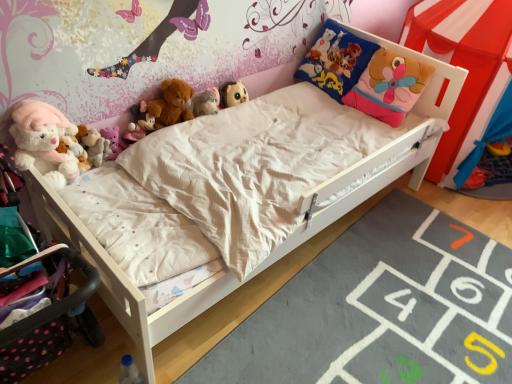
What do you see at coordinates (139, 123) in the screenshot? Image resolution: width=512 pixels, height=384 pixels. I see `matte pink plush at upper left, which ranks as the fourth toy in top-to-bottom order` at bounding box center [139, 123].

Measure the distance between red fabric canopy bed at upper right and camera.

The depth of red fabric canopy bed at upper right is 1.83 meters.

Locate an element on the screen. The height and width of the screenshot is (384, 512). fluffy plush toys at left, which ranks as the 6th toy in top-to-bottom order is located at coordinates [x=96, y=147].

Where is `matte pink plush at upper left, which ranks as the fourth toy in top-to-bottom order`? matte pink plush at upper left, which ranks as the fourth toy in top-to-bottom order is located at coordinates (139, 123).

In the scene shown: Which object is further away from the camera, gray soft rug at lower right or red fabric canopy bed at upper right?

red fabric canopy bed at upper right is more distant.

Is gray soft rug at lower right located outside red fabric canopy bed at upper right?

Yes, gray soft rug at lower right is not within red fabric canopy bed at upper right.

Is gray soft rug at lower right positioned with its back to red fabric canopy bed at upper right?

That's not correct — gray soft rug at lower right is not looking away from red fabric canopy bed at upper right.

Looking at this image, between gray soft rug at lower right and red fabric canopy bed at upper right, which one has less height?

With less height is gray soft rug at lower right.

Considering the sizes of objects fluffy white teddy bear at center, which ranks as the 1th toy in top-to-bottom order, and brown plush bear at upper center, arranged as the third toy when viewed from the top, in the image provided, who is wider, fluffy white teddy bear at center, which ranks as the 1th toy in top-to-bottom order, or brown plush bear at upper center, arranged as the third toy when viewed from the top,?

brown plush bear at upper center, arranged as the third toy when viewed from the top.

Which object is more forward, fluffy white teddy bear at center, positioned as the 8th toy in bottom-to-top order, or brown plush bear at upper center, arranged as the third toy when viewed from the top?

Positioned in front is brown plush bear at upper center, arranged as the third toy when viewed from the top.

From the image's perspective, would you say fluffy white teddy bear at center, positioned as the 8th toy in bottom-to-top order, is shown under brown plush bear at upper center, arranged as the third toy when viewed from the top?

Actually, fluffy white teddy bear at center, positioned as the 8th toy in bottom-to-top order, appears above brown plush bear at upper center, arranged as the third toy when viewed from the top, in the image.

From a real-world perspective, which object rests below the other?

fluffy plush toy at upper center, the second toy when ordered from top to bottom.

Does point (139, 139) lie behind point (212, 97)?

No.

Is matte pink plush at upper left, which ranks as the fourth toy in top-to-bottom order, placed right next to fluffy plush toy at upper center, the second toy when ordered from top to bottom?

matte pink plush at upper left, which ranks as the fourth toy in top-to-bottom order, and fluffy plush toy at upper center, the second toy when ordered from top to bottom, are clearly separated.

Does matte pink plush at upper left, which ranks as the fourth toy in top-to-bottom order, appear on the left side of fluffy plush toy at upper center, which is the 7th toy from bottom to top?

Correct, you'll find matte pink plush at upper left, which ranks as the fourth toy in top-to-bottom order, to the left of fluffy plush toy at upper center, which is the 7th toy from bottom to top.

From a real-world perspective, is fluffy plush toy at upper center, the second toy when ordered from top to bottom, physically located above or below matte pink plush at upper left, which is counted as the fifth toy, starting from the bottom?

fluffy plush toy at upper center, the second toy when ordered from top to bottom, is below matte pink plush at upper left, which is counted as the fifth toy, starting from the bottom.

Is matte pink plush at upper left, which is counted as the fifth toy, starting from the bottom, surrounded by fluffy plush toy at upper center, the second toy when ordered from top to bottom?

No.

Is fluffy plush toy at upper center, which is the 7th toy from bottom to top, bigger or smaller than matte pink plush at upper left, which is counted as the fifth toy, starting from the bottom?

In the image, fluffy plush toy at upper center, which is the 7th toy from bottom to top, appears to be smaller than matte pink plush at upper left, which is counted as the fifth toy, starting from the bottom.

From the image's perspective, which one is positioned lower, fluffy plush toy at upper center, which is the 7th toy from bottom to top, or matte pink plush at upper left, which ranks as the fourth toy in top-to-bottom order?

matte pink plush at upper left, which ranks as the fourth toy in top-to-bottom order, from the image's perspective.

Which is in front, fluffy plush toys at left, which ranks as the 6th toy in top-to-bottom order, or blue plastic bottle at lower left, the 8th toy from the top?

blue plastic bottle at lower left, the 8th toy from the top.

Considering the relative sizes of fluffy plush toys at left, which ranks as the 6th toy in top-to-bottom order, and blue plastic bottle at lower left, the first toy ordered from the bottom, in the image provided, is fluffy plush toys at left, which ranks as the 6th toy in top-to-bottom order, wider than blue plastic bottle at lower left, the first toy ordered from the bottom,?

Yes, fluffy plush toys at left, which ranks as the 6th toy in top-to-bottom order, is wider than blue plastic bottle at lower left, the first toy ordered from the bottom.

From the image's perspective, which toy is the 2nd one above the blue plastic bottle at lower left, the first toy ordered from the bottom? Please provide its 2D coordinates.

[(96, 147)]

Consider the image. Which is more to the left, fluffy plush toys at left, the third toy positioned from the bottom, or blue plastic bottle at lower left, the 8th toy from the top?

fluffy plush toys at left, the third toy positioned from the bottom.

From a real-world perspective, which object stands above the other?

fluffy plush toy at upper center, the second toy when ordered from top to bottom, is physically above.

Between blue plastic bottle at lower left, the first toy ordered from the bottom, and fluffy plush toy at upper center, the second toy when ordered from top to bottom, which one is positioned behind?

fluffy plush toy at upper center, the second toy when ordered from top to bottom, is further away from the camera.

Locate an element on the screen. Image resolution: width=512 pixels, height=384 pixels. the 4th toy positioned above the blue plastic bottle at lower left, the 8th toy from the top (from a real-world perspective) is located at coordinates [x=205, y=103].

Looking at this image, in terms of width, does blue plastic bottle at lower left, the first toy ordered from the bottom, look wider or thinner when compared to fluffy plush toy at upper center, which is the 7th toy from bottom to top?

Considering their sizes, blue plastic bottle at lower left, the first toy ordered from the bottom, looks slimmer than fluffy plush toy at upper center, which is the 7th toy from bottom to top.

This screenshot has height=384, width=512. I want to click on the 3rd toy to the right of the pink plush toy at upper left, which appears as the fourth toy when ordered from the bottom, starting your count from the anchor, so click(170, 104).

Does point (106, 130) lie behind point (183, 116)?

No, it is in front of (183, 116).

Which object is positioned more to the right, pink plush toy at upper left, which appears as the fourth toy when ordered from the bottom, or brown plush bear at upper center, arranged as the third toy when viewed from the top?

From the viewer's perspective, brown plush bear at upper center, arranged as the third toy when viewed from the top, appears more on the right side.

The height and width of the screenshot is (384, 512). In order to click on mat that is under the red fabric canopy bed at upper right (from a real-world perspective) in this screenshot , I will do `click(377, 308)`.

Which toy is the 2nd one when counting from the right side of the brown plush bear at upper center, marked as the 6th toy in a bottom-to-top arrangement? Please provide its 2D coordinates.

[(215, 95)]

Considering their positions, is pink plush toy at upper left, which appears as the fourth toy when ordered from the bottom, positioned closer to brown plush bear at upper center, marked as the 6th toy in a bottom-to-top arrangement, than fluffy plush toy at upper center, the second toy when ordered from top to bottom?

fluffy plush toy at upper center, the second toy when ordered from top to bottom, is positioned closer to the anchor brown plush bear at upper center, marked as the 6th toy in a bottom-to-top arrangement.

Considering their positions, is gray soft rug at lower right positioned further to fluffy white plush at upper left, acting as the 7th toy starting from the top, than fluffy plush toys at left, which ranks as the 6th toy in top-to-bottom order?

gray soft rug at lower right.

Considering their positions, is fluffy white plush at upper left, positioned as the 2th toy in bottom-to-top order, positioned further to brown plush bear at upper center, arranged as the third toy when viewed from the top, than red fabric canopy bed at upper right?

The object further to brown plush bear at upper center, arranged as the third toy when viewed from the top, is red fabric canopy bed at upper right.

Based on their spatial positions, is matte pink plush at upper left, which ranks as the fourth toy in top-to-bottom order, or gray soft rug at lower right closer to red fabric canopy bed at upper right?

The object closer to red fabric canopy bed at upper right is gray soft rug at lower right.

Which object lies further to the anchor point matte pink plush at upper left, which ranks as the fourth toy in top-to-bottom order, pink plush toy at upper left, which appears as the fourth toy when ordered from the bottom, or fluffy white plush at upper left, acting as the 7th toy starting from the top?

fluffy white plush at upper left, acting as the 7th toy starting from the top.

Consider the image. When comparing their distances from brown plush bear at upper center, arranged as the third toy when viewed from the top, does red fabric canopy bed at upper right or fluffy plush toy at upper center, the second toy when ordered from top to bottom, seem closer?

fluffy plush toy at upper center, the second toy when ordered from top to bottom, is closer to brown plush bear at upper center, arranged as the third toy when viewed from the top.

Looking at the image, which one is located closer to matte pink plush at upper left, which is counted as the fifth toy, starting from the bottom, red fabric canopy bed at upper right or brown plush bear at upper center, arranged as the third toy when viewed from the top?

brown plush bear at upper center, arranged as the third toy when viewed from the top.

Based on their spatial positions, is fluffy white plush at upper left, acting as the 7th toy starting from the top, or fluffy white teddy bear at center, positioned as the 8th toy in bottom-to-top order, further from soft plush pillow at upper right?

fluffy white plush at upper left, acting as the 7th toy starting from the top.

Where is `toy between fluffy plush toy at upper center, which is the 7th toy from bottom to top, and soft plush pillow at upper right, in the horizontal direction`? This screenshot has width=512, height=384. toy between fluffy plush toy at upper center, which is the 7th toy from bottom to top, and soft plush pillow at upper right, in the horizontal direction is located at coordinates (215, 95).

Where is `mat between pink plush toy at upper left, which ranks as the 5th toy in top-to-bottom order, and red fabric canopy bed at upper right from left to right`? Image resolution: width=512 pixels, height=384 pixels. mat between pink plush toy at upper left, which ranks as the 5th toy in top-to-bottom order, and red fabric canopy bed at upper right from left to right is located at coordinates (377, 308).

Find the location of a particular element. mat between blue plastic bottle at lower left, the first toy ordered from the bottom, and red fabric canopy bed at upper right, in the horizontal direction is located at coordinates 377,308.

Find the location of a particular element. The image size is (512, 384). mat between fluffy white teddy bear at center, positioned as the 8th toy in bottom-to-top order, and red fabric canopy bed at upper right is located at coordinates (377, 308).